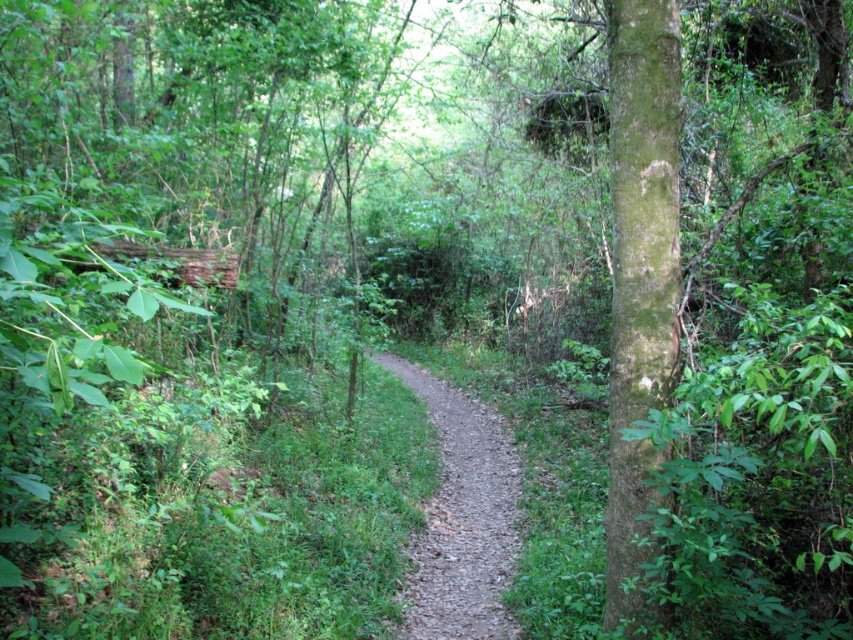
Question: Which point is closer to the camera?

Choices:
 (A) (434, 564)
 (B) (624, 408)

Answer: (B)

Question: Can you confirm if green mossy bark tree at right is bigger than dirt path at center?

Choices:
 (A) no
 (B) yes

Answer: (A)

Question: Does green mossy bark tree at right appear over dirt path at center?

Choices:
 (A) yes
 (B) no

Answer: (A)

Question: Which point appears farthest from the camera in this image?

Choices:
 (A) (614, 433)
 (B) (445, 451)

Answer: (B)

Question: Does green mossy bark tree at right appear under dirt path at center?

Choices:
 (A) yes
 (B) no

Answer: (B)